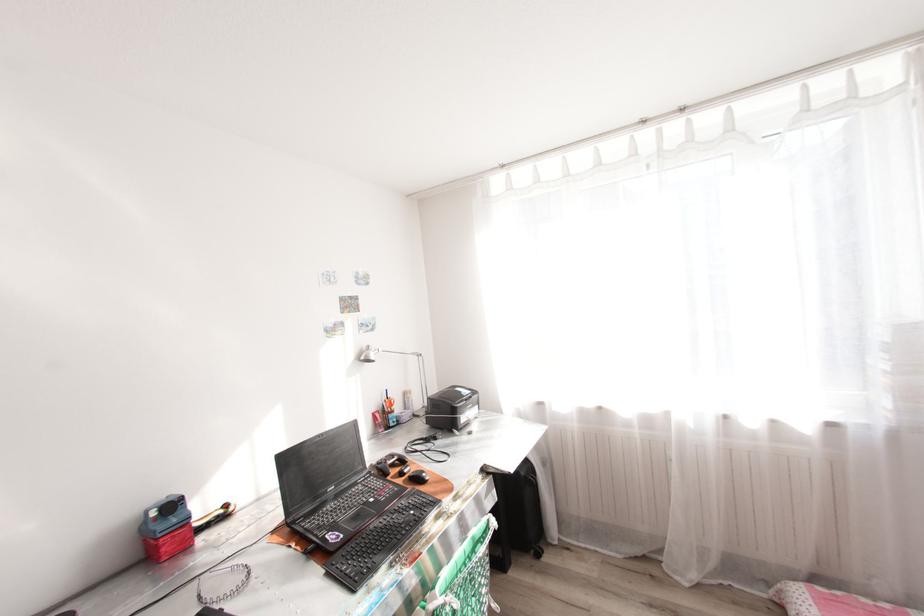
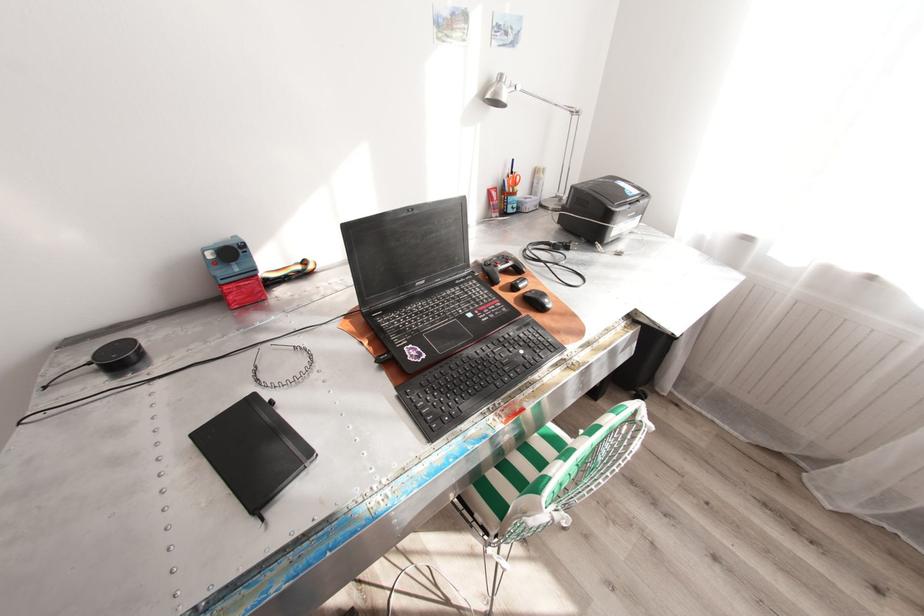
The point at (157, 514) is marked in the first image. Where is the corresponding point in the second image?

(215, 254)